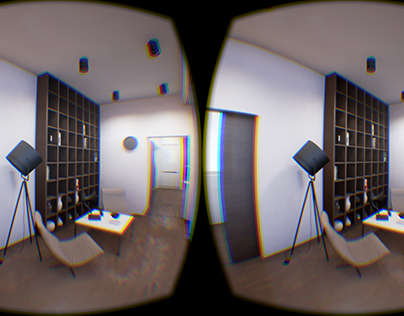
The image size is (404, 316). Find the location of `lamp shade`. lamp shade is located at coordinates click(315, 153), click(15, 158).